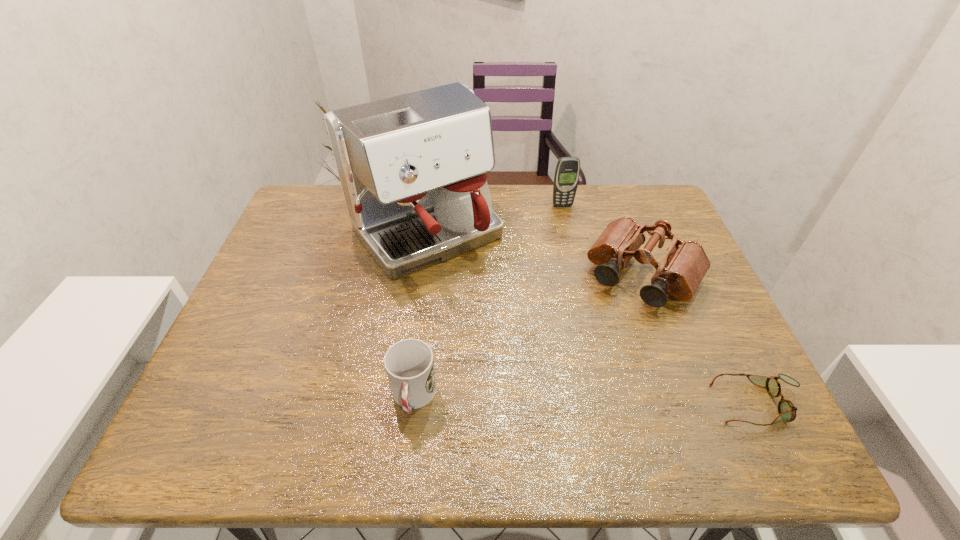
This screenshot has width=960, height=540. I want to click on spectacles that is at the near edge, so click(x=787, y=411).

I want to click on spectacles positioned at the right edge, so click(x=787, y=411).

I want to click on binoculars located in the right edge section of the desktop, so click(684, 265).

Find the location of `object at the near right corner`. object at the near right corner is located at coordinates (787, 411).

Locate an element on the screen. free region at the far edge is located at coordinates (574, 206).

Image resolution: width=960 pixels, height=540 pixels. What are the coordinates of `vacant space at the near edge of the desktop` in the screenshot? It's located at (650, 379).

Find the location of a particular element. The image size is (960, 540). free space at the left edge is located at coordinates (248, 338).

The width and height of the screenshot is (960, 540). In the image, there is a desktop. What are the coordinates of `free space at the right edge` in the screenshot? It's located at (697, 314).

You are a GUI agent. You are given a task and a screenshot of the screen. Output one action in this format:
    pyautogui.click(x=<x>, y=<y>)
    Task: Click on the vacant space at the far left corner of the desktop
    
    Given the screenshot: What is the action you would take?
    pyautogui.click(x=300, y=194)

This screenshot has width=960, height=540. In the image, there is a desktop. What are the coordinates of `free space at the far right corner` in the screenshot? It's located at (632, 197).